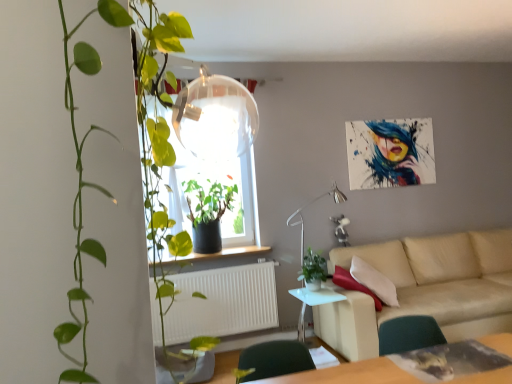
This screenshot has width=512, height=384. I want to click on vacant point above white matte radiator at lower center (from a real-world perspective), so click(220, 264).